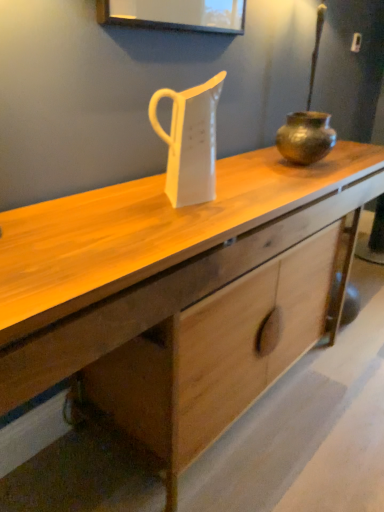
Question: From a real-world perspective, does white glossy jug at center stand above bronze textured pot at center?

Choices:
 (A) no
 (B) yes

Answer: (B)

Question: From the image's perspective, is white glossy jug at center located beneath bronze textured pot at center?

Choices:
 (A) no
 (B) yes

Answer: (B)

Question: Would you say white glossy jug at center is outside bronze textured pot at center?

Choices:
 (A) yes
 (B) no

Answer: (A)

Question: Does white glossy jug at center turn towards bronze textured pot at center?

Choices:
 (A) yes
 (B) no

Answer: (B)

Question: Is white glossy jug at center smaller than bronze textured pot at center?

Choices:
 (A) no
 (B) yes

Answer: (A)

Question: Would you say white glossy jug at center is inside or outside bronze metallic pot at right?

Choices:
 (A) inside
 (B) outside

Answer: (B)

Question: In terms of width, does white glossy jug at center look wider or thinner when compared to bronze metallic pot at right?

Choices:
 (A) thin
 (B) wide

Answer: (A)

Question: Considering the positions of point pyautogui.click(x=162, y=89) and point pyautogui.click(x=304, y=139), is point pyautogui.click(x=162, y=89) closer or farther from the camera than point pyautogui.click(x=304, y=139)?

Choices:
 (A) closer
 (B) farther

Answer: (A)

Question: In the image, is white glossy jug at center on the left side or the right side of bronze metallic pot at right?

Choices:
 (A) left
 (B) right

Answer: (A)

Question: From the image's perspective, is bronze textured pot at center located above or below wooden desk at center?

Choices:
 (A) above
 (B) below

Answer: (A)

Question: Would you say bronze textured pot at center is inside or outside wooden desk at center?

Choices:
 (A) inside
 (B) outside

Answer: (B)

Question: Would you say bronze textured pot at center is to the left or to the right of wooden desk at center in the picture?

Choices:
 (A) right
 (B) left

Answer: (A)

Question: Relative to wooden desk at center, is bronze textured pot at center in front or behind?

Choices:
 (A) behind
 (B) front

Answer: (A)

Question: Looking at the image, does bronze textured pot at center seem bigger or smaller compared to white glossy jug at center?

Choices:
 (A) big
 (B) small

Answer: (B)

Question: Is bronze textured pot at center to the left or to the right of white glossy jug at center in the image?

Choices:
 (A) left
 (B) right

Answer: (B)